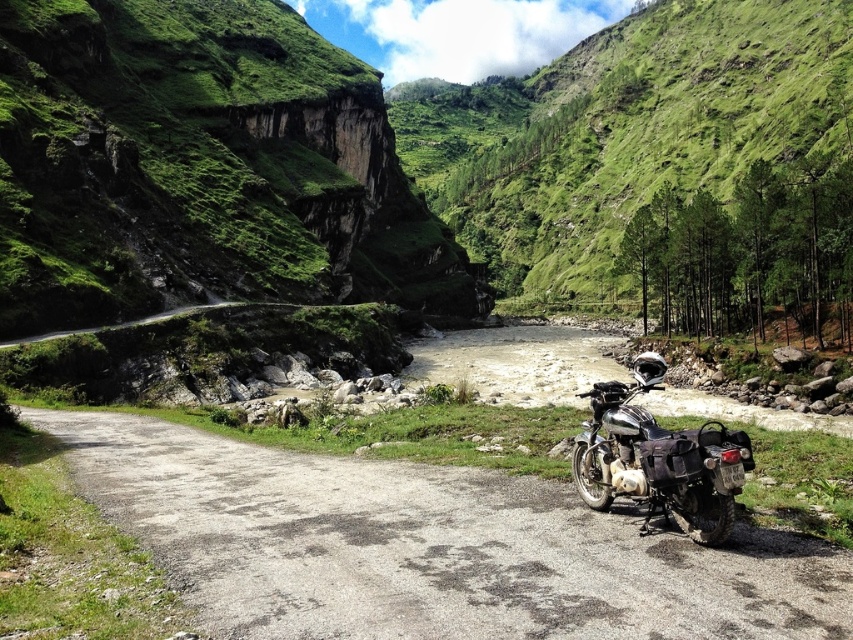
Based on the photo, can you confirm if green grassy hillside at center is positioned below shiny chrome motorcycle at center?

No.

Between green grassy hillside at center and shiny chrome motorcycle at center, which one appears on the left side from the viewer's perspective?

shiny chrome motorcycle at center

Does point (840, 321) come farther from viewer compared to point (624, 408)?

Yes, point (840, 321) is behind point (624, 408).

Where is `green grassy hillside at center`? Image resolution: width=853 pixels, height=640 pixels. green grassy hillside at center is located at coordinates (662, 164).

Consider the image. Does green grassy hillside at center have a larger size compared to smooth asphalt road at center?

Yes.

Between green grassy hillside at center and smooth asphalt road at center, which one has more height?

green grassy hillside at center is taller.

At what (x,y) coordinates should I click in order to perform the action: click on green grassy hillside at center. Please return your answer as a coordinate pair (x, y). This screenshot has height=640, width=853. Looking at the image, I should click on (662, 164).

At what (x,y) coordinates should I click in order to perform the action: click on green grassy hillside at center. Please return your answer as a coordinate pair (x, y). This screenshot has height=640, width=853. Looking at the image, I should click on (662, 164).

From the picture: Which of these two, smooth asphalt road at center or shiny chrome motorcycle at center, stands taller?

With more height is shiny chrome motorcycle at center.

Identify the location of smooth asphalt road at center. The height and width of the screenshot is (640, 853). (428, 547).

Does point (251, 561) come farther from viewer compared to point (634, 419)?

No.

Where is `smooth asphalt road at center`? This screenshot has height=640, width=853. smooth asphalt road at center is located at coordinates (428, 547).